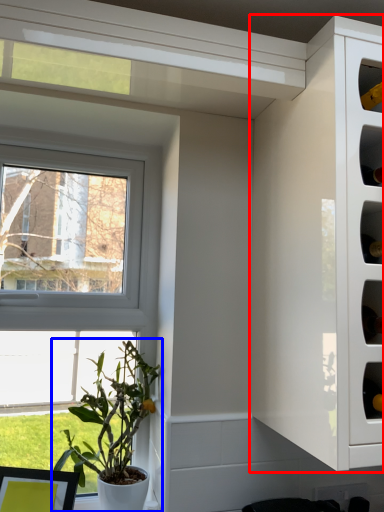
Question: Which of the following is the closest to the observer, cabinetry (highlighted by a red box) or houseplant (highlighted by a blue box)?

Choices:
 (A) cabinetry
 (B) houseplant

Answer: (A)